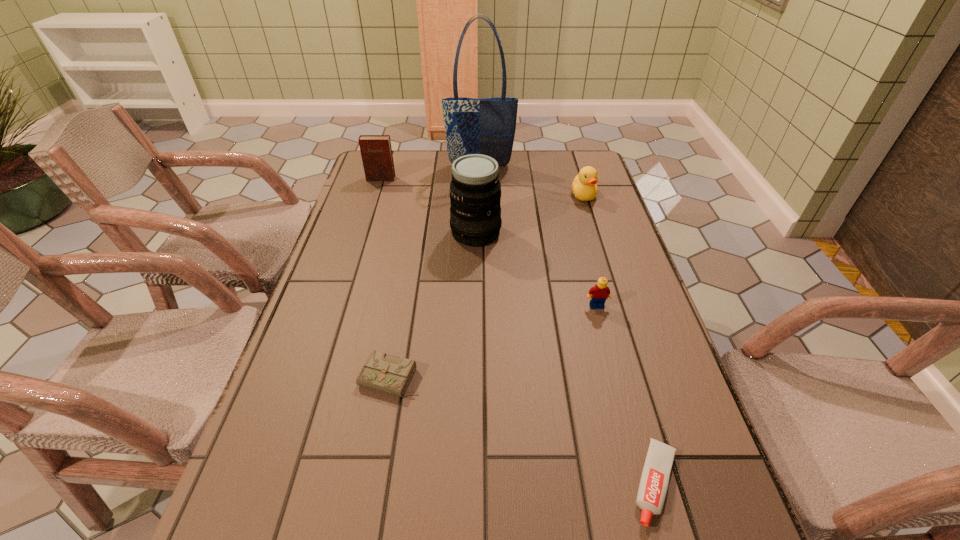
In order to click on empty space between the nearest object and the tallest object in this screenshot , I will do `click(568, 325)`.

You are a GUI agent. You are given a task and a screenshot of the screen. Output one action in this format:
    pyautogui.click(x=<x>, y=<y>)
    Task: Click on the free space between the third shortest object and the duckling
    
    Given the screenshot: What is the action you would take?
    pyautogui.click(x=590, y=251)

Find the location of a particular element. This screenshot has height=540, width=960. empty location between the shopping bag and the toothpaste is located at coordinates (568, 325).

Find the location of a particular element. free space between the farther diary and the toothpaste is located at coordinates (518, 331).

Locate an element on the screen. free space between the fifth tallest object and the nearer diary is located at coordinates (493, 342).

Find the location of a particular element. free spot between the Lego and the sixth shortest object is located at coordinates (537, 269).

This screenshot has height=540, width=960. Identify the location of empty location between the shorter diary and the farthest object. (435, 272).

This screenshot has height=540, width=960. I want to click on vacant space that is in between the toothpaste and the left diary, so click(x=518, y=331).

This screenshot has width=960, height=540. In order to click on vacant area between the farthest object and the right diary in this screenshot , I will do `click(435, 272)`.

You are a GUI agent. You are given a task and a screenshot of the screen. Output one action in this format:
    pyautogui.click(x=<x>, y=<y>)
    Task: Click on the object that is the closest to the Lego
    The image size is (960, 540).
    Given the screenshot: What is the action you would take?
    pyautogui.click(x=475, y=190)